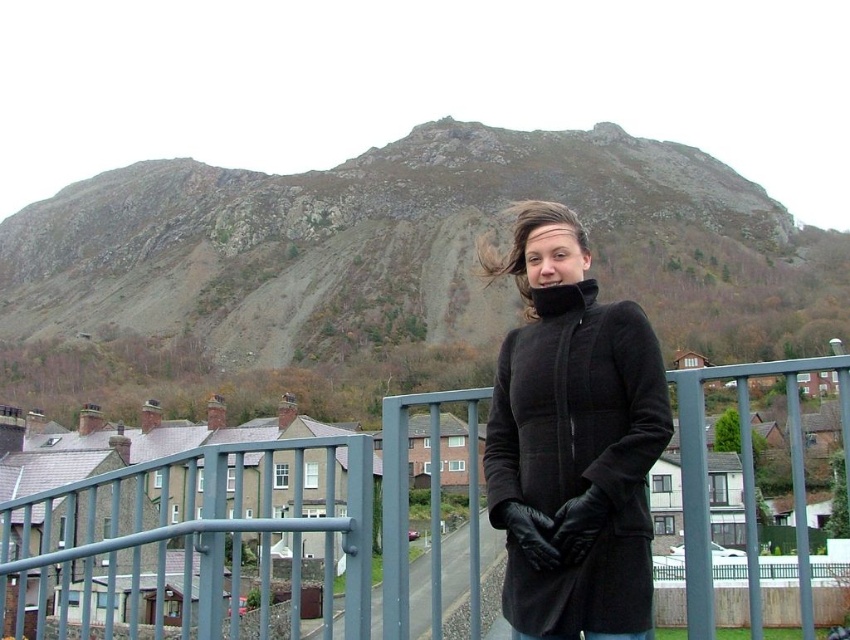
You are standing on the bridge and want to reach the point at coordinates point (503,298). Given that your walking speed is 1.5 meters per second, how long will it take you to reach that point?

The distance of point (503,298) from viewer is 200.69 meters. At a walking speed of 1.5 meters per second, it will take approximately 133.79 seconds to reach the point.

You are a hiker who wants to take a photo of the rough stone mountain at upper center and the metallic gray fence at center. Which object should you focus on first if you want to capture both in a single frame without moving your camera? Explain your reasoning based on their positions.

You should focus on the rough stone mountain at upper center first because it is taller than the metallic gray fence at center. Since the mountain is taller, positioning the camera to include its full height will naturally include the shorter fence in the frame as well.